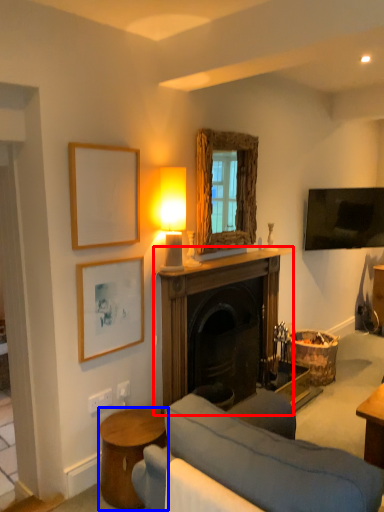
Question: Which of the following is the farthest to the observer, fireplace (highlighted by a red box) or table (highlighted by a blue box)?

Choices:
 (A) fireplace
 (B) table

Answer: (A)